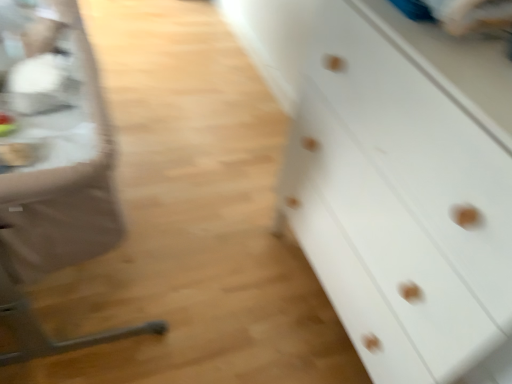
This screenshot has width=512, height=384. What do you see at coordinates (53, 109) in the screenshot? I see `metallic silver table at left` at bounding box center [53, 109].

The height and width of the screenshot is (384, 512). What are the coordinates of `metallic silver feeding chair at left` in the screenshot? It's located at [x=56, y=187].

Is metallic silver feeding chair at left surrounded by metallic silver table at left?

No, metallic silver feeding chair at left is not inside metallic silver table at left.

Based on the photo, can you confirm if metallic silver table at left is smaller than metallic silver feeding chair at left?

Indeed, metallic silver table at left has a smaller size compared to metallic silver feeding chair at left.

From the image's perspective, does metallic silver table at left appear higher than metallic silver feeding chair at left?

Yes.

Is metallic silver table at left wider or thinner than metallic silver feeding chair at left?

Clearly, metallic silver table at left has less width compared to metallic silver feeding chair at left.

Is metallic silver feeding chair at left not inside white matte chest of drawers at right?

Yes, metallic silver feeding chair at left is not within white matte chest of drawers at right.

Is metallic silver feeding chair at left turned away from white matte chest of drawers at right?

No.

Is metallic silver feeding chair at left taller or shorter than white matte chest of drawers at right?

Considering their sizes, metallic silver feeding chair at left has less height than white matte chest of drawers at right.

Is metallic silver feeding chair at left directly adjacent to white matte chest of drawers at right?

metallic silver feeding chair at left and white matte chest of drawers at right are clearly separated.

Which of these two, metallic silver table at left or white matte chest of drawers at right, stands taller?

Standing taller between the two is white matte chest of drawers at right.

Does metallic silver table at left have a greater width compared to white matte chest of drawers at right?

Incorrect, the width of metallic silver table at left does not surpass that of white matte chest of drawers at right.

How far apart are metallic silver table at left and white matte chest of drawers at right?

The distance of metallic silver table at left from white matte chest of drawers at right is 24.91 inches.

From a real-world perspective, which is physically below, metallic silver table at left or white matte chest of drawers at right?

white matte chest of drawers at right, from a real-world perspective.

Considering the relative sizes of white matte chest of drawers at right and metallic silver table at left in the image provided, is white matte chest of drawers at right shorter than metallic silver table at left?

No, white matte chest of drawers at right is not shorter than metallic silver table at left.

I want to click on table above the white matte chest of drawers at right (from the image's perspective), so click(53, 109).

From the image's perspective, which one is positioned higher, white matte chest of drawers at right or metallic silver table at left?

From the image's view, metallic silver table at left is above.

Which object is wider, white matte chest of drawers at right or metallic silver table at left?

With larger width is white matte chest of drawers at right.

Is white matte chest of drawers at right positioned before metallic silver feeding chair at left?

Yes, white matte chest of drawers at right is closer to the camera.

Locate an element on the screen. Image resolution: width=512 pixels, height=384 pixels. the chest of drawers below the metallic silver feeding chair at left (from the image's perspective) is located at coordinates (392, 180).

Is point (255, 37) closer to viewer compared to point (48, 21)?

No, it is not.

Is white matte chest of drawers at right positioned with its back to metallic silver feeding chair at left?

No.

How many degrees apart are the facing directions of metallic silver feeding chair at left and metallic silver table at left?

0.0362 degrees.

From the image's perspective, which object appears higher, metallic silver feeding chair at left or metallic silver table at left?

metallic silver table at left.

Relative to metallic silver table at left, is metallic silver feeding chair at left in front or behind?

Visually, metallic silver feeding chair at left is located in front of metallic silver table at left.

At what (x,y) coordinates should I click in order to perform the action: click on feeding chair that is in front of the metallic silver table at left. Please return your answer as a coordinate pair (x, y). Looking at the image, I should click on (56, 187).

At what (x,y) coordinates should I click in order to perform the action: click on feeding chair behind the white matte chest of drawers at right. Please return your answer as a coordinate pair (x, y). This screenshot has height=384, width=512. Looking at the image, I should click on (56, 187).

Estimate the real-world distances between objects in this image. Which object is further from metallic silver feeding chair at left, white matte chest of drawers at right or metallic silver table at left?

white matte chest of drawers at right lies further to metallic silver feeding chair at left than the other object.

Considering their positions, is metallic silver feeding chair at left positioned closer to metallic silver table at left than white matte chest of drawers at right?

metallic silver feeding chair at left lies closer to metallic silver table at left than the other object.

Considering their positions, is white matte chest of drawers at right positioned further to metallic silver table at left than metallic silver feeding chair at left?

white matte chest of drawers at right.

Which object lies further to the anchor point white matte chest of drawers at right, metallic silver table at left or metallic silver feeding chair at left?

metallic silver table at left.

From the picture: Based on their spatial positions, is metallic silver feeding chair at left or metallic silver table at left further from white matte chest of drawers at right?

metallic silver table at left is positioned further to the anchor white matte chest of drawers at right.

Which object lies nearer to the anchor point metallic silver feeding chair at left, metallic silver table at left or white matte chest of drawers at right?

metallic silver table at left is positioned closer to the anchor metallic silver feeding chair at left.

The height and width of the screenshot is (384, 512). Identify the location of feeding chair between metallic silver table at left and white matte chest of drawers at right from left to right. (56, 187).